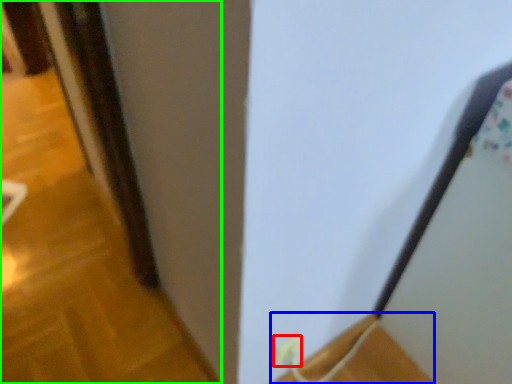
Question: Which object is the farthest from electric outlet (highlighted by a red box)? Choose among these: wood (highlighted by a blue box) or door (highlighted by a green box).

Choices:
 (A) wood
 (B) door

Answer: (B)